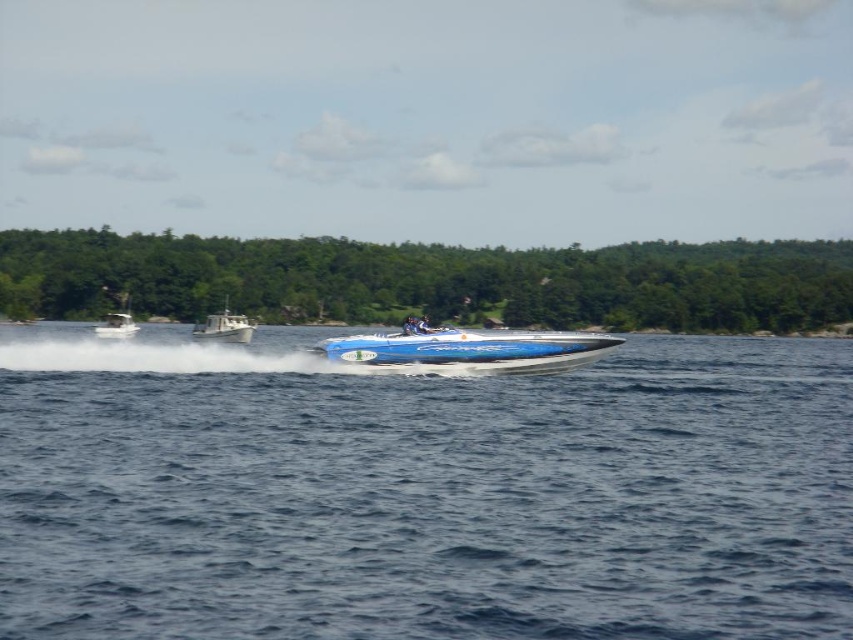
Question: Considering the relative positions of blue metallic speedboat at center and blue glossy speedboat at center in the image provided, where is blue metallic speedboat at center located with respect to blue glossy speedboat at center?

Choices:
 (A) below
 (B) above

Answer: (A)

Question: Which point is farther to the camera?

Choices:
 (A) (59, 365)
 (B) (541, 337)
 (C) (109, 321)

Answer: (C)

Question: Considering the relative positions of blue metallic speedboat at center and blue glossy speedboat at center in the image provided, where is blue metallic speedboat at center located with respect to blue glossy speedboat at center?

Choices:
 (A) above
 (B) below

Answer: (B)

Question: Considering the real-world distances, which object is closest to the blue metallic speedboat at center?

Choices:
 (A) blue glossy speedboat at center
 (B) white matte boat at left
 (C) blue glossy water at center

Answer: (C)

Question: Which of the following is the closest to the observer?

Choices:
 (A) (236, 316)
 (B) (107, 330)
 (C) (561, 346)

Answer: (C)

Question: Can you confirm if blue metallic speedboat at center is positioned above white matte boat at left?

Choices:
 (A) no
 (B) yes

Answer: (A)